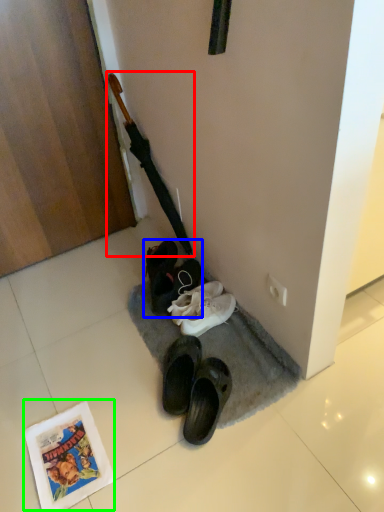
Question: Considering the real-world distances, which object is farthest from crucifix (highlighted by a red box)? footwear (highlighted by a blue box) or comic book (highlighted by a green box)?

Choices:
 (A) footwear
 (B) comic book

Answer: (B)